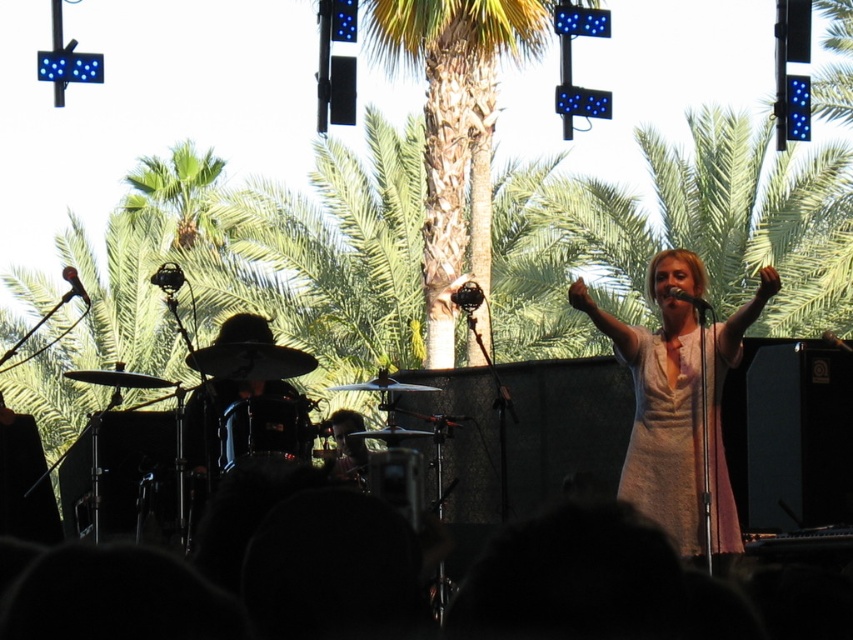
Question: Which object is positioned closest to the black matte microphone at center?

Choices:
 (A) white satin dress at center
 (B) black matte microphone at upper left

Answer: (A)

Question: Considering the relative positions of silhouette heads at lower center and black matte microphone at center in the image provided, where is silhouette heads at lower center located with respect to black matte microphone at center?

Choices:
 (A) above
 (B) below

Answer: (B)

Question: Which object is positioned farthest from the black matte microphone at center?

Choices:
 (A) silhouette heads at lower center
 (B) white satin dress at center
 (C) green textured bark at center
 (D) black matte microphone at upper left

Answer: (C)

Question: Is silhouette heads at lower center thinner than black matte microphone at upper left?

Choices:
 (A) yes
 (B) no

Answer: (A)

Question: Among these objects, which one is farthest from the camera?

Choices:
 (A) black matte microphone at center
 (B) black matte microphone at upper left
 (C) silhouette heads at lower center

Answer: (A)

Question: Is the position of silhouette heads at lower center less distant than that of green textured bark at center?

Choices:
 (A) yes
 (B) no

Answer: (A)